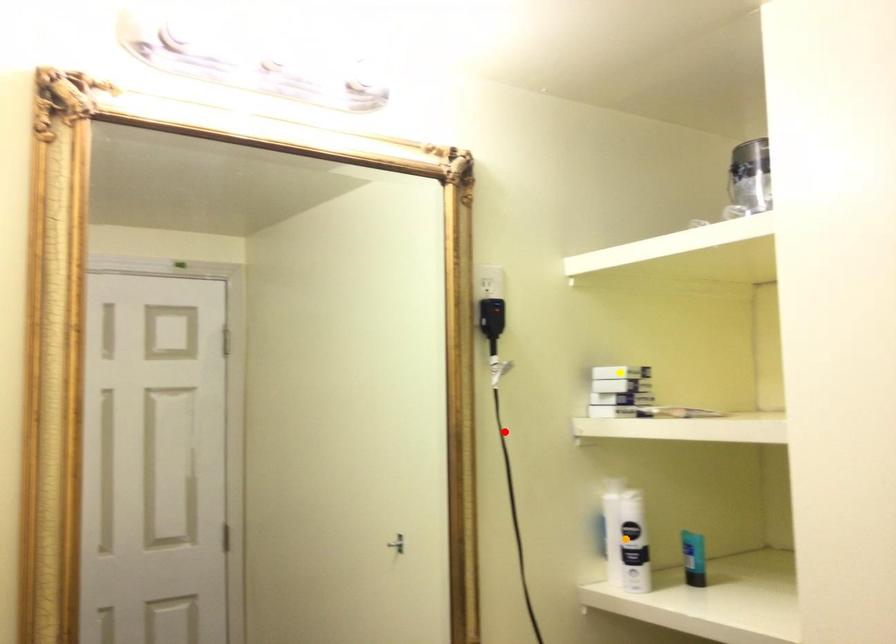
Order these from nearest to farthest:
yellow point | orange point | red point

red point, orange point, yellow point